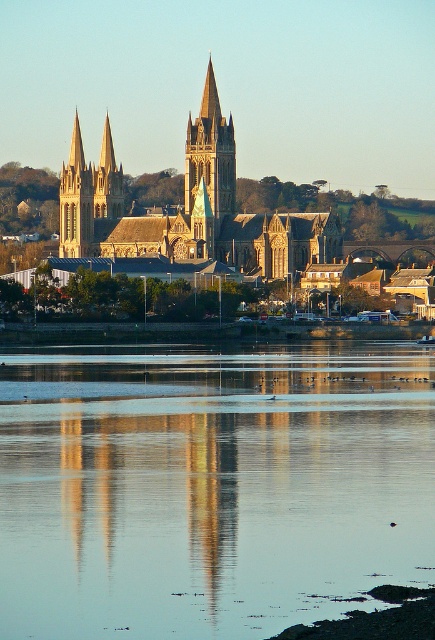
Is the position of silvery reflective water at center less distant than that of golden stone tower at center?

Yes, it is.

Which of these two, silvery reflective water at center or golden stone tower at center, stands taller?

golden stone tower at center is taller.

Measure the distance between point (143, 600) and camera.

The distance of point (143, 600) from camera is 72.68 meters.

Identify the location of silvery reflective water at center. Image resolution: width=435 pixels, height=640 pixels. (210, 486).

Is golden stone church at center smaller than golden stone tower at center?

No, golden stone church at center is not smaller than golden stone tower at center.

Between golden stone church at center and golden stone tower at center, which one is positioned higher?

golden stone tower at center is above.

The height and width of the screenshot is (640, 435). Identify the location of golden stone church at center. (187, 209).

Locate an element on the screen. golden stone church at center is located at coordinates 187,209.

Locate an element on the screen. silvery reflective water at center is located at coordinates point(210,486).

In the scene shown: Is silvery reflective water at center above golden stone church at center?

Actually, silvery reflective water at center is below golden stone church at center.

Is point (260, 490) behind point (76, 200)?

No, (260, 490) is in front of (76, 200).

This screenshot has height=640, width=435. What are the coordinates of `silvery reflective water at center` in the screenshot? It's located at (210, 486).